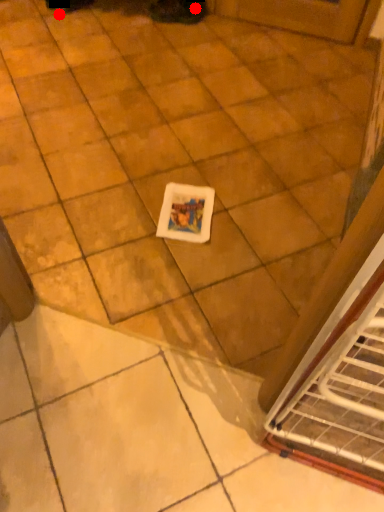
Question: Two points are circled on the image, labeled by A and B beside each circle. Which of the following is the closest to the observer?

Choices:
 (A) A is closer
 (B) B is closer

Answer: (B)